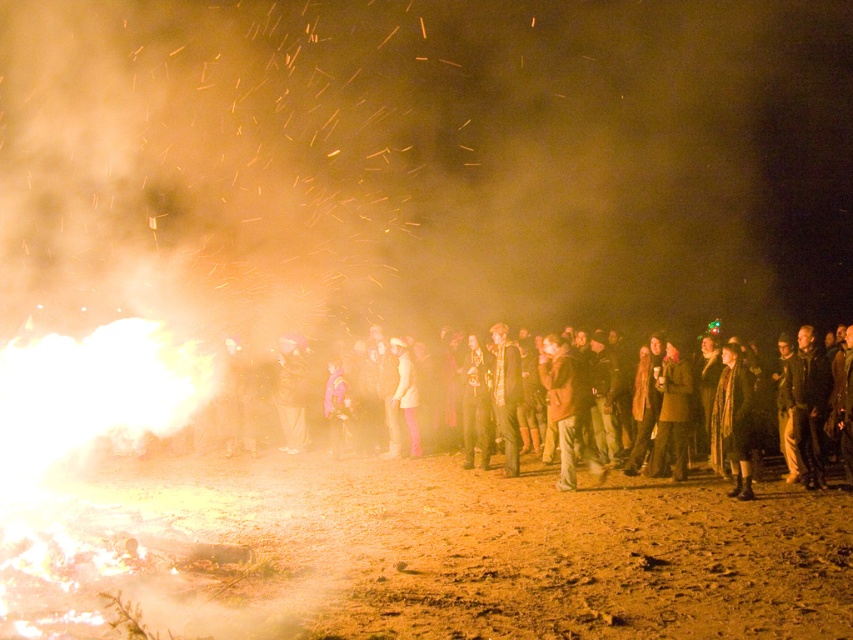
Is brown sandy ground at lower left to the right of dark brown leather jackets at center from the viewer's perspective?

In fact, brown sandy ground at lower left is to the left of dark brown leather jackets at center.

Between point (489, 602) and point (395, 465), which one is positioned behind?

The point (395, 465) is more distant.

Identify the location of brown sandy ground at lower left. This screenshot has width=853, height=640. (437, 554).